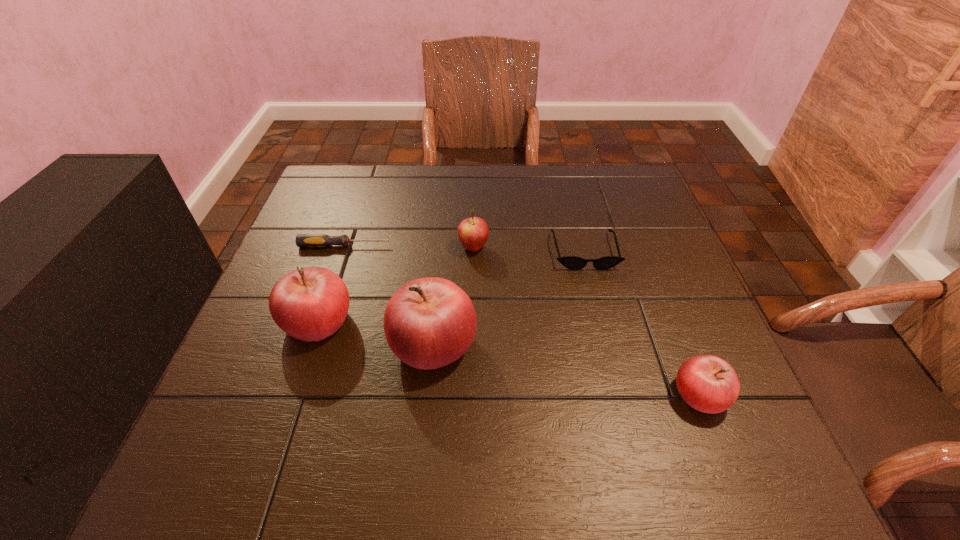
This screenshot has height=540, width=960. I want to click on free space located 0.210m on the left of the third shortest object, so click(557, 395).

Identify the location of vacant space situated on the front-facing side of the sunglasses. The image size is (960, 540). 604,330.

Identify the location of free spot located on the back of the fourth shortest object. (474, 200).

The width and height of the screenshot is (960, 540). I want to click on free space located insert the screwdriver into a screw head, so pos(467,246).

In order to click on apple that is at the left edge in this screenshot , I will do `click(309, 304)`.

Where is `screwdriver positioned at the left edge`? The height and width of the screenshot is (540, 960). screwdriver positioned at the left edge is located at coordinates (302, 240).

The width and height of the screenshot is (960, 540). Identify the location of apple positioned at the right edge. (707, 383).

Identify the location of sunglasses located at the right edge. The image size is (960, 540). (571, 262).

This screenshot has width=960, height=540. I want to click on object that is at the near right corner, so click(707, 383).

This screenshot has height=540, width=960. Identify the location of vacant space at the far edge of the desktop. (538, 211).